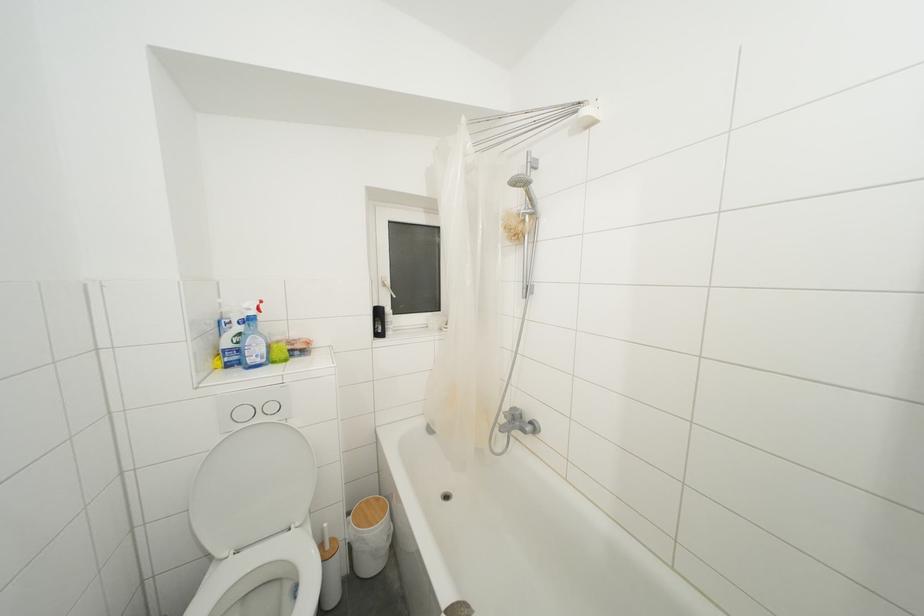
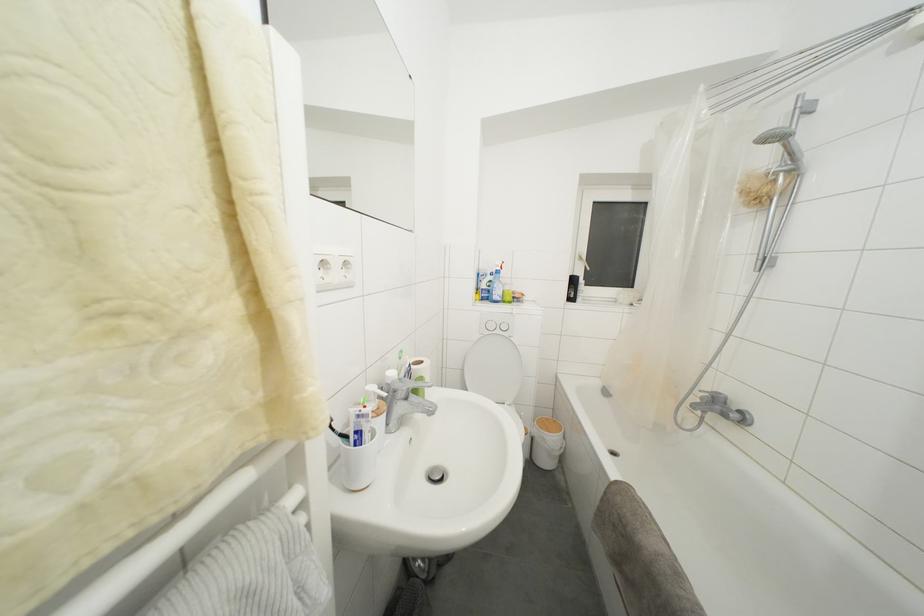
Where in the second image is the point corresponding to pixel 302 355 from the first image?

(520, 304)